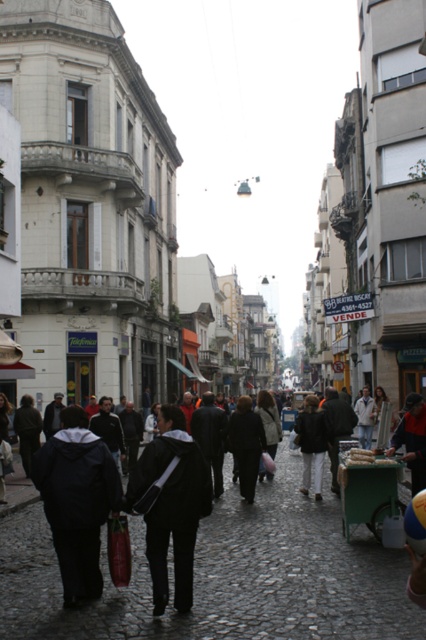
Question: Among these points, which one is nearest to the camera?

Choices:
 (A) (157, 598)
 (B) (347, 544)

Answer: (A)

Question: Can you confirm if black fabric crowd at center is positioned below black fabric bag at center?

Choices:
 (A) no
 (B) yes

Answer: (B)

Question: Can you confirm if black fabric crowd at center is wider than black fabric bag at center?

Choices:
 (A) yes
 (B) no

Answer: (A)

Question: Is black fabric crowd at center thinner than black fabric bag at center?

Choices:
 (A) yes
 (B) no

Answer: (B)